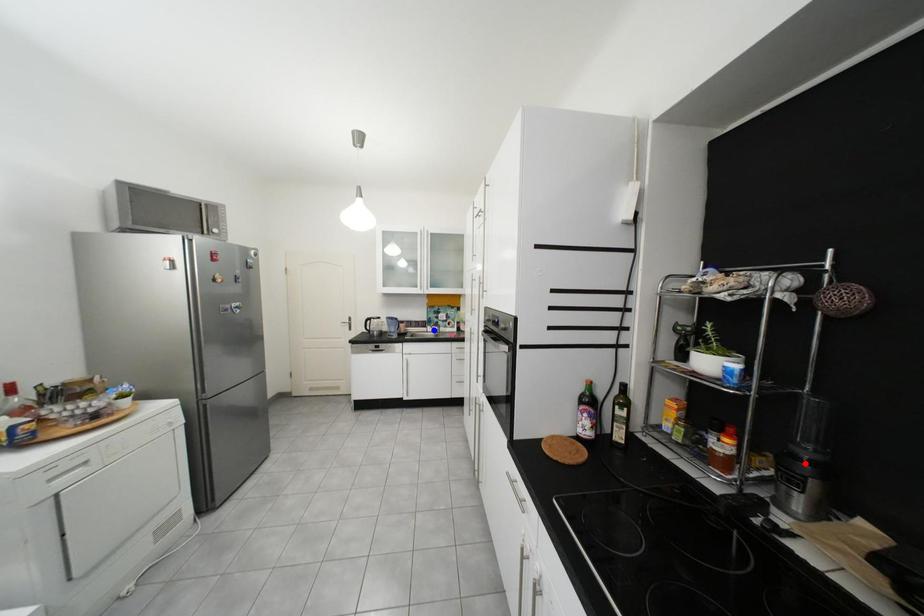
Question: Which of the two points in the image is closer to the camera?

Choices:
 (A) Blue point is closer.
 (B) Red point is closer.

Answer: (B)